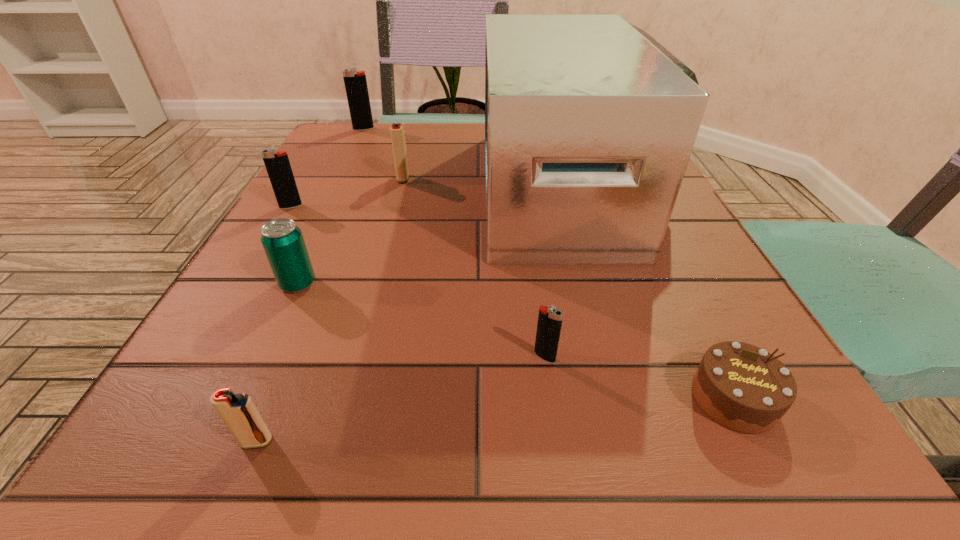
The width and height of the screenshot is (960, 540). Identify the location of the smaller red igniter. (239, 413).

This screenshot has width=960, height=540. Identify the location of the left red igniter. (239, 413).

Where is `the smallest black igniter`? This screenshot has height=540, width=960. the smallest black igniter is located at coordinates (549, 324).

This screenshot has width=960, height=540. In order to click on the rightmost black igniter in this screenshot , I will do `click(549, 324)`.

Identify the location of chocolate cake. (742, 387).

Locate an element on the screen. This screenshot has height=540, width=960. brown chocolate cake is located at coordinates (742, 387).

Where is `vacant space situated on the front-facing side of the microwave oven`? The image size is (960, 540). vacant space situated on the front-facing side of the microwave oven is located at coordinates (451, 189).

Find the location of a particular element. free space located 0.180m on the front-facing side of the microwave oven is located at coordinates (397, 189).

The image size is (960, 540). In order to click on blank space located 0.260m on the front-facing side of the microwave oven in this screenshot , I will do `click(358, 189)`.

You are a GUI agent. You are given a task and a screenshot of the screen. Output one action in this format:
    pyautogui.click(x=<x>, y=<y>)
    Task: Click on the vacant position located on the right of the farthest black igniter
    
    Given the screenshot: What is the action you would take?
    pyautogui.click(x=475, y=129)